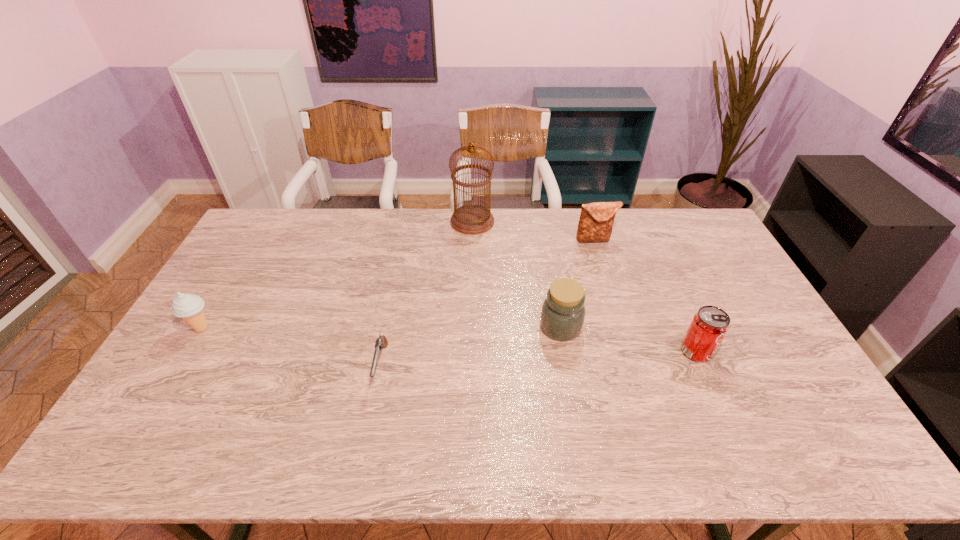
Where is `the tallest object`? The width and height of the screenshot is (960, 540). the tallest object is located at coordinates (472, 219).

At what (x,y) coordinates should I click in order to perform the action: click on birdcage. Please return your answer as a coordinate pair (x, y). Image resolution: width=960 pixels, height=540 pixels. Looking at the image, I should click on (472, 219).

You are a GUI agent. You are given a task and a screenshot of the screen. Output one action in this format:
    pyautogui.click(x=<x>, y=<y>)
    Task: Click on the fifth object from left to right
    
    Given the screenshot: What is the action you would take?
    pyautogui.click(x=596, y=220)

You are a GUI agent. You are given a task and a screenshot of the screen. Output one action in this format:
    pyautogui.click(x=<x>, y=<y>)
    Task: Click on the jar
    This screenshot has width=960, height=540.
    Given the screenshot: What is the action you would take?
    pyautogui.click(x=562, y=317)

You are a GUI agent. You are given a task and a screenshot of the screen. Output one action in this format:
    pyautogui.click(x=<x>, y=<y>)
    Task: Click on the rightmost object
    
    Given the screenshot: What is the action you would take?
    pyautogui.click(x=710, y=324)

Identify the location of the leftmost object. The width and height of the screenshot is (960, 540). (189, 307).

Where is `the shortest object`? The height and width of the screenshot is (540, 960). the shortest object is located at coordinates (381, 342).

Identify the location of gun. The image size is (960, 540). (381, 342).

At what (x,y) coordinates should I click in order to perform the action: click on free space located 0.060m on the front-facing side of the birdcage. Please return your answer as a coordinate pair (x, y). Looking at the image, I should click on (510, 221).

You are a GUI agent. You are given a task and a screenshot of the screen. Output one action in this format:
    pyautogui.click(x=<x>, y=<y>)
    Task: Click on the free region located 0.150m on the open side of the clutch bag
    The image size is (960, 540).
    Given the screenshot: What is the action you would take?
    pyautogui.click(x=605, y=274)